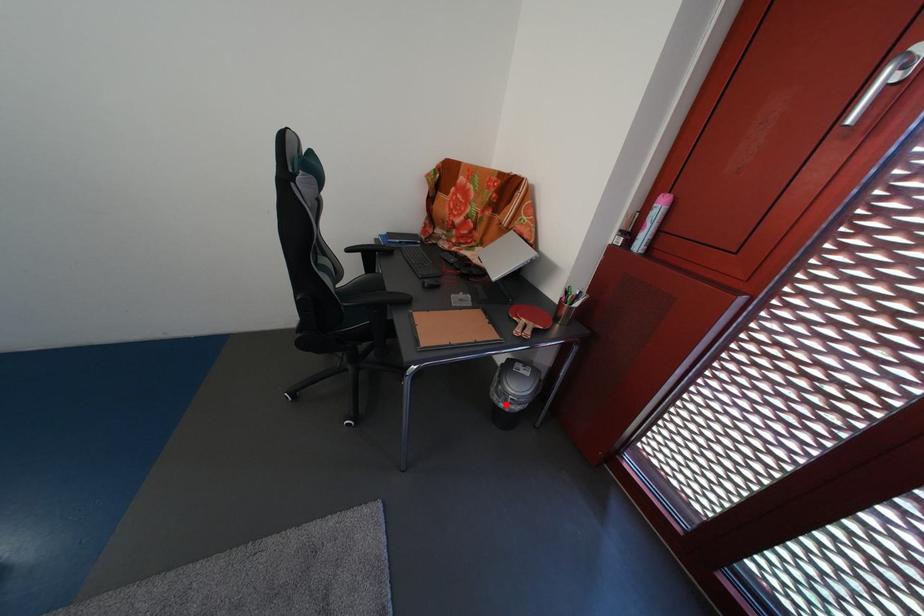
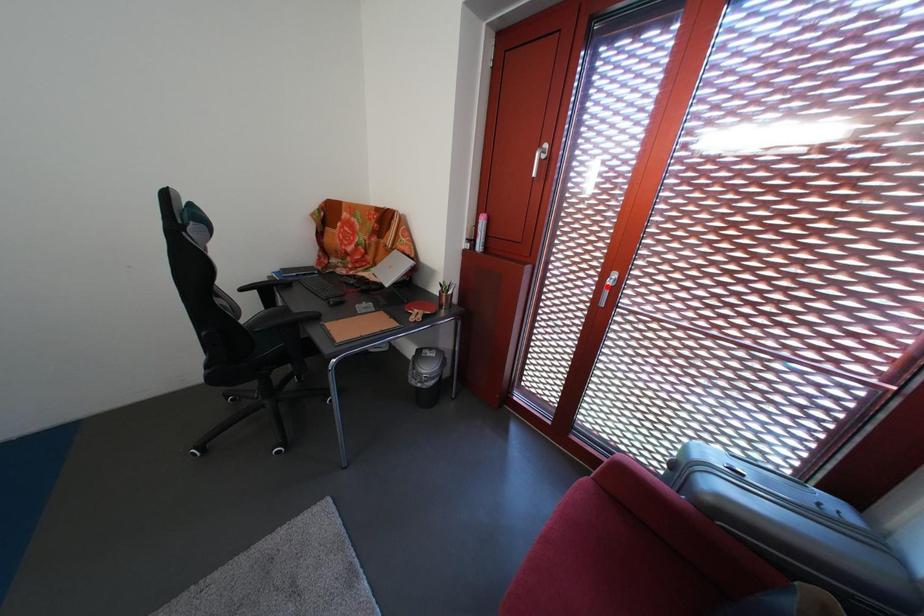
I am providing you with two images of the same scene from different viewpoints. A red point is marked on the first image and another point is marked on the second image. Are the points marked in image1 and image2 representing the same 3D position?

No